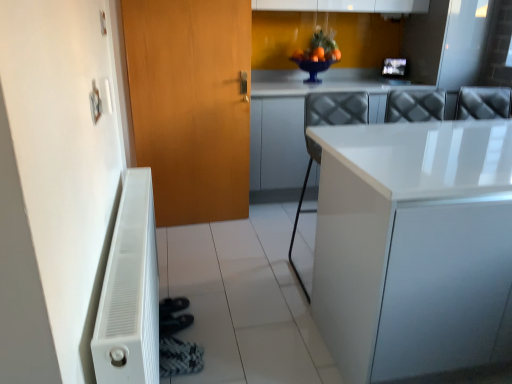
This screenshot has width=512, height=384. Find the location of `black textured shoe at lower left`. black textured shoe at lower left is located at coordinates (179, 357).

I want to click on wooden door at left, so click(191, 104).

At what (x,y) coordinates should I click in order to perform the action: click on white glossy counter top at upper right. Please return your answer as a coordinate pair (x, y). This screenshot has height=384, width=512. Looking at the image, I should click on (298, 123).

Identify the location of black textured shoe at lower left. The image size is (512, 384). (179, 357).

Between white matte radiator at lower left and wooden door at left, which one appears on the left side from the viewer's perspective?

Positioned to the left is white matte radiator at lower left.

Locate an element on the screen. Image resolution: width=512 pixels, height=384 pixels. radiator lying in front of the wooden door at left is located at coordinates (130, 291).

Between white matte radiator at lower left and wooden door at left, which one has smaller width?

wooden door at left.

Which of these two, white matte radiator at lower left or wooden door at left, stands taller?

wooden door at left is taller.

Which object is more forward, white matte radiator at lower left or white glossy counter top at upper right?

white matte radiator at lower left is more forward.

In the scene shown: Is white matte radiator at lower left next to white glossy counter top at upper right and touching it?

There is a gap between white matte radiator at lower left and white glossy counter top at upper right.

From the image's perspective, is white matte radiator at lower left under white glossy counter top at upper right?

Yes.

Which of these two, white matte radiator at lower left or white glossy counter top at upper right, is bigger?

With larger size is white glossy counter top at upper right.

Measure the distance between white glossy countertop at center and white glossy chair at center.

The distance of white glossy countertop at center from white glossy chair at center is 23.97 inches.

In terms of size, does white glossy countertop at center appear bigger or smaller than white glossy chair at center?

white glossy countertop at center is bigger than white glossy chair at center.

Is there a large distance between white glossy countertop at center and white glossy chair at center?

No, there isn't a large distance between white glossy countertop at center and white glossy chair at center.

Can you tell me how much white glossy countertop at center and white glossy chair at center differ in facing direction?

The angle between the facing direction of white glossy countertop at center and the facing direction of white glossy chair at center is 0.338 degrees.

Are white matte radiator at lower left and white glossy chair at center making contact?

No.

Does white matte radiator at lower left have a smaller size compared to white glossy chair at center?

Yes, white matte radiator at lower left is smaller than white glossy chair at center.

Is point (127, 176) less distant than point (309, 116)?

Yes, point (127, 176) is closer to viewer.

Is white matte radiator at lower left aimed at white glossy chair at center?

Yes, white matte radiator at lower left is turned towards white glossy chair at center.

Between point (253, 74) and point (162, 356), which one is positioned in front?

Positioned in front is point (162, 356).

Based on their sizes in the image, would you say white glossy counter top at upper right is bigger or smaller than black textured shoe at lower left?

white glossy counter top at upper right is bigger than black textured shoe at lower left.

Considering the positions of objects white glossy counter top at upper right and black textured shoe at lower left in the image provided, who is more to the left, white glossy counter top at upper right or black textured shoe at lower left?

Positioned to the left is black textured shoe at lower left.

Image resolution: width=512 pixels, height=384 pixels. Find the location of `counter top above the black textured shoe at lower left (from the image's perspective)`. counter top above the black textured shoe at lower left (from the image's perspective) is located at coordinates pos(298,123).

Considering the sizes of wooden door at left and white glossy chair at center in the image, is wooden door at left wider or thinner than white glossy chair at center?

Considering their sizes, wooden door at left looks slimmer than white glossy chair at center.

Would you say wooden door at left contains white glossy chair at center?

No, wooden door at left does not contain white glossy chair at center.

Would you say wooden door at left is a long distance from white glossy chair at center?

No.

Is black textured shoe at lower left not within white glossy counter top at upper right?

Yes.

From the image's perspective, which is below, black textured shoe at lower left or white glossy counter top at upper right?

From the image's view, black textured shoe at lower left is below.

Is black textured shoe at lower left directly adjacent to white glossy counter top at upper right?

No, black textured shoe at lower left is not with white glossy counter top at upper right.

In order to click on radiator below the wooden door at left (from the image's perspective) in this screenshot , I will do `click(130, 291)`.

This screenshot has height=384, width=512. I want to click on radiator that is in front of the white glossy counter top at upper right, so click(130, 291).

Estimate the real-world distances between objects in this image. Which object is closer to wooden door at left, white matte radiator at lower left or white glossy countertop at center?

Among the two, white matte radiator at lower left is located nearer to wooden door at left.

Considering their positions, is wooden door at left positioned closer to white glossy counter top at upper right than black textured shoe at lower left?

wooden door at left is positioned closer to the anchor white glossy counter top at upper right.

Looking at the image, which one is located closer to white glossy countertop at center, black textured shoe at lower left or white matte radiator at lower left?

white matte radiator at lower left.

When comparing their distances from wooden door at left, does white matte radiator at lower left or white glossy chair at center seem further?

The object further to wooden door at left is white matte radiator at lower left.

From the image, which object appears to be farther from black textured shoe at lower left, white glossy counter top at upper right or white glossy countertop at center?

Among the two, white glossy counter top at upper right is located further to black textured shoe at lower left.

Looking at the image, which one is located closer to white glossy countertop at center, black textured shoe at lower left or white glossy counter top at upper right?

black textured shoe at lower left is closer to white glossy countertop at center.

Looking at the image, which one is located further to white glossy countertop at center, white glossy counter top at upper right or wooden door at left?

white glossy counter top at upper right lies further to white glossy countertop at center than the other object.

From the image, which object appears to be nearer to white glossy countertop at center, white matte radiator at lower left or white glossy chair at center?

The object closer to white glossy countertop at center is white glossy chair at center.

Find the location of a particular element. The image size is (512, 384). shoe between white matte radiator at lower left and white glossy counter top at upper right along the z-axis is located at coordinates (179, 357).

Identify the location of shoe between wooden door at left and white glossy countertop at center in the horizontal direction. The width and height of the screenshot is (512, 384). (179, 357).

The width and height of the screenshot is (512, 384). What are the coordinates of `chair located between black textured shoe at lower left and white glossy counter top at upper right in the depth direction` in the screenshot? It's located at (327, 124).

The width and height of the screenshot is (512, 384). Find the location of `door located between white matte radiator at lower left and white glossy counter top at upper right in the depth direction`. door located between white matte radiator at lower left and white glossy counter top at upper right in the depth direction is located at coordinates (191, 104).